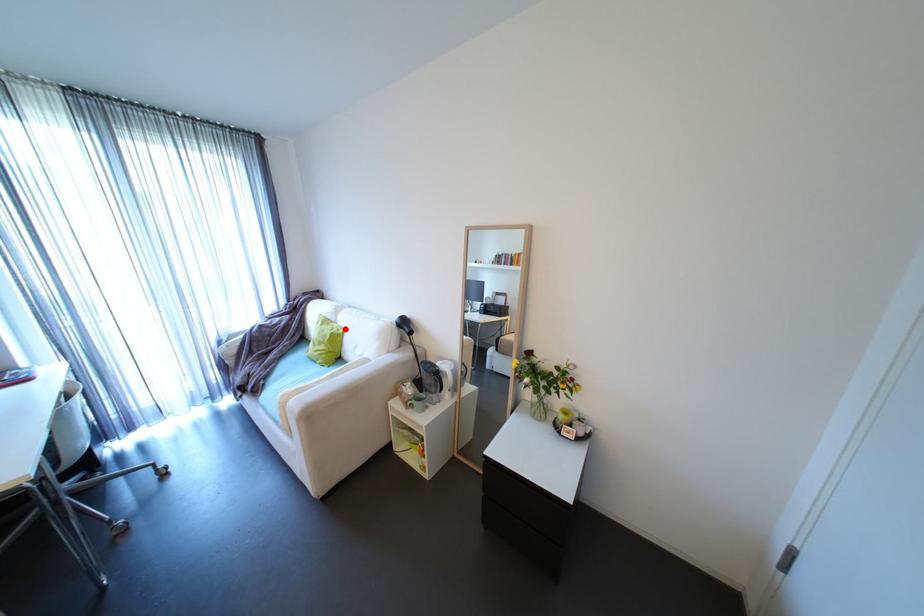
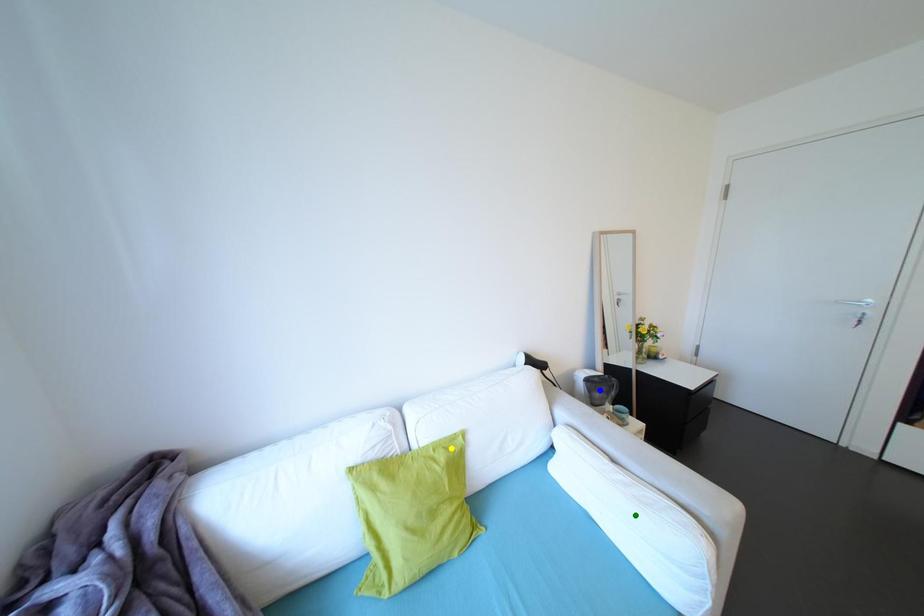
Question: I am providing you with two images of the same scene from different viewpoints. A red point is marked on the first image. You are given multiple points on the second image. Which spot in image 2 lines up with the point in image 1?

Choices:
 (A) blue point
 (B) green point
 (C) yellow point

Answer: (C)